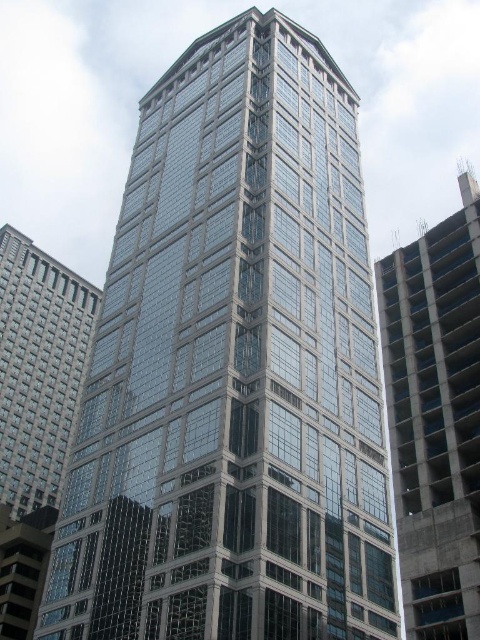
You are an architect examining the modern skyscraper. You notice the concrete at right and the matte glass building at left. Which object is located above the other?

The concrete at right is positioned over the matte glass building at left, meaning it is above the other.

You are standing in the middle of the street looking at the skyscraper. There is concrete at right and a matte glass building at left. Which object is positioned to the right side of the street?

The concrete at right is positioned to the right side of the street.